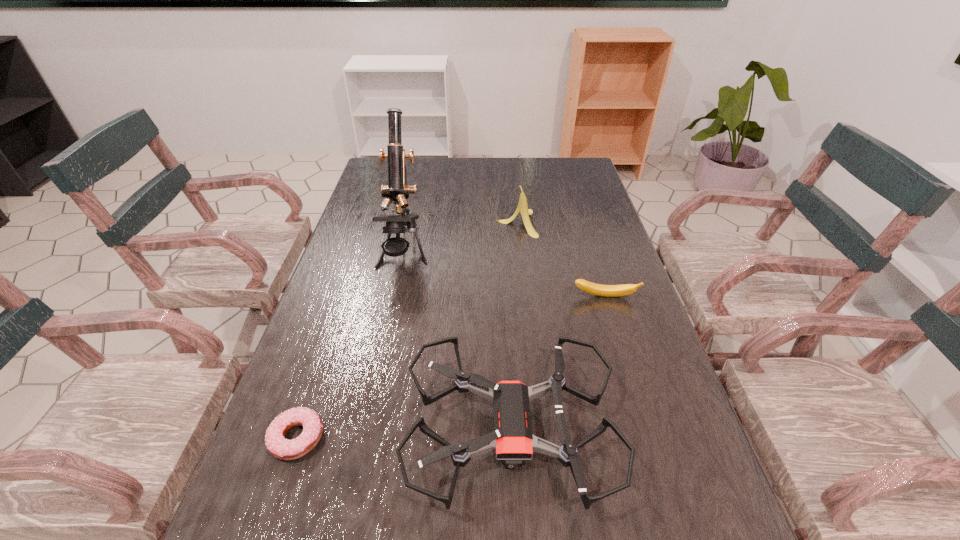
At what (x,y) coordinates should I click in order to perform the action: click on vacant region located on the left of the fourth shortest object. Please return your answer as a coordinate pair (x, y). Looking at the image, I should click on [x=396, y=224].

This screenshot has width=960, height=540. Identify the location of free space located with the camera facing forward on the drone. (300, 430).

This screenshot has width=960, height=540. In order to click on free location located 0.050m with the camera facing forward on the drone in this screenshot , I will do `click(382, 430)`.

Find the location of a particular element. vacant area situated with the camera facing forward on the drone is located at coordinates (376, 430).

Find the location of a particular element. The width and height of the screenshot is (960, 540). free spot located at the stem of the nearer banana is located at coordinates (646, 430).

Identify the location of vacant region located 0.280m on the right of the leftmost object. This screenshot has height=540, width=960. (469, 438).

Where is `microscope that is at the left edge`? microscope that is at the left edge is located at coordinates pyautogui.click(x=397, y=190).

Identify the location of doughnut located in the left edge section of the desktop. (279, 447).

Identify the location of drone present at the right edge. (512, 439).

Where is `banana positioned at the right edge`? The width and height of the screenshot is (960, 540). banana positioned at the right edge is located at coordinates (592, 288).